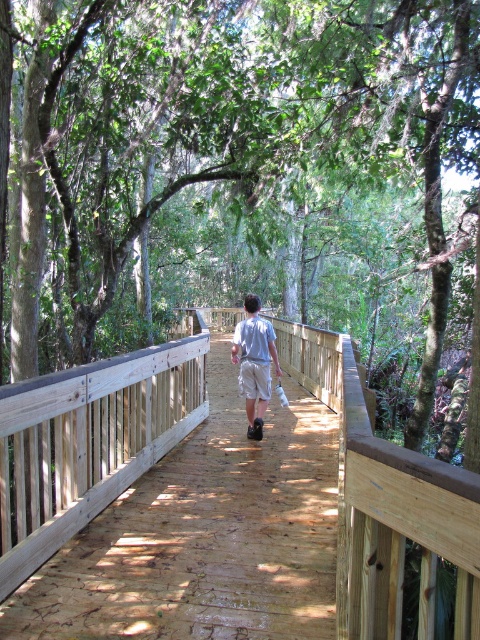
Question: Among these points, which one is nearest to the camera?

Choices:
 (A) 86,432
 (B) 252,371
 (C) 263,390
 (D) 31,218

Answer: (A)

Question: Observing the image, what is the correct spatial positioning of green leafy tree at center in reference to light gray cotton shirt at center?

Choices:
 (A) left
 (B) right

Answer: (A)

Question: Which point is closer to the camera?

Choices:
 (A) brown wooden bridge at center
 (B) green leafy tree at center

Answer: (A)

Question: Can you confirm if brown wooden bridge at center is positioned above tan cotton shorts at center?

Choices:
 (A) yes
 (B) no

Answer: (B)

Question: Which is farther from the tan cotton shorts at center?

Choices:
 (A) light gray cotton shirt at center
 (B) green leafy tree at center

Answer: (B)

Question: Is brown wooden bridge at center positioned at the back of light gray cotton shirt at center?

Choices:
 (A) no
 (B) yes

Answer: (A)